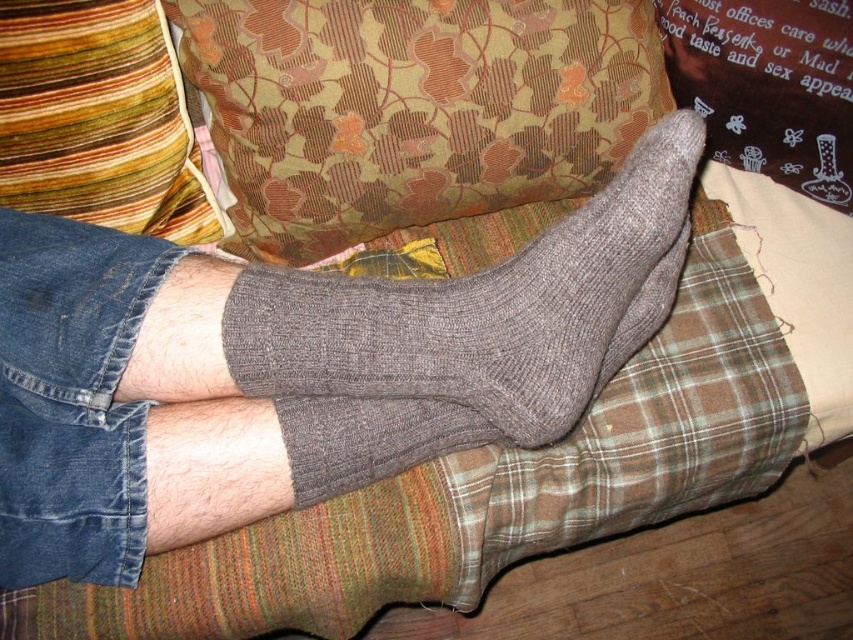
Question: Which is nearer to the gray knitted sock at upper center?

Choices:
 (A) denim shorts at lower left
 (B) brown textured pillow at upper center

Answer: (B)

Question: Can you confirm if brown textured pillow at upper center is positioned above multicolored striped pillow at upper left?

Choices:
 (A) no
 (B) yes

Answer: (B)

Question: Which object is the farthest from the brown textured pillow at upper center?

Choices:
 (A) denim shorts at lower left
 (B) gray knitted sock at upper center

Answer: (A)

Question: From the image, what is the correct spatial relationship of gray knitted sock at upper center in relation to denim shorts at lower left?

Choices:
 (A) above
 (B) below

Answer: (A)

Question: Can you confirm if brown textured pillow at upper center is wider than denim shorts at lower left?

Choices:
 (A) no
 (B) yes

Answer: (B)

Question: Among these points, which one is nearest to the camera?

Choices:
 (A) (135, 516)
 (B) (305, 81)
 (C) (258, 288)
 (D) (10, 68)

Answer: (C)